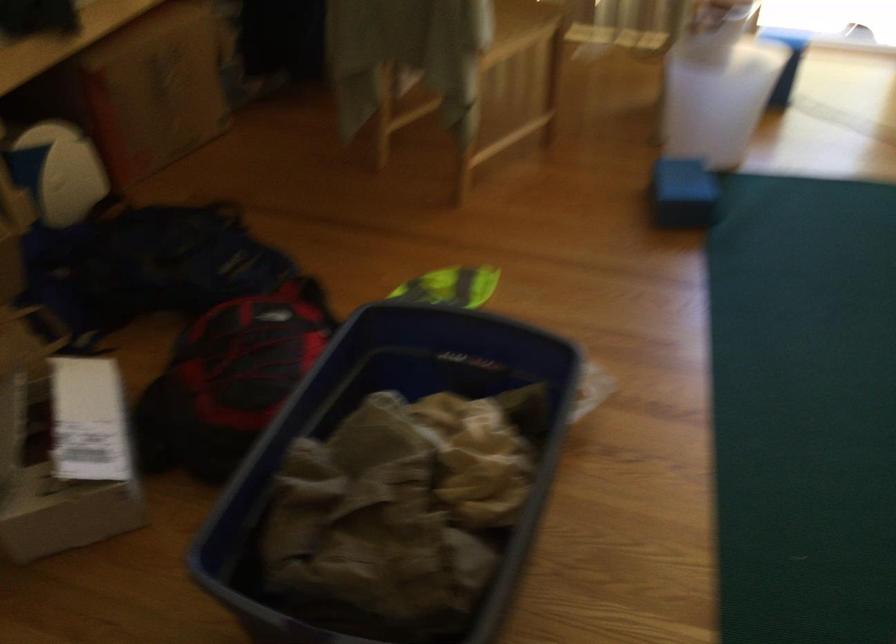
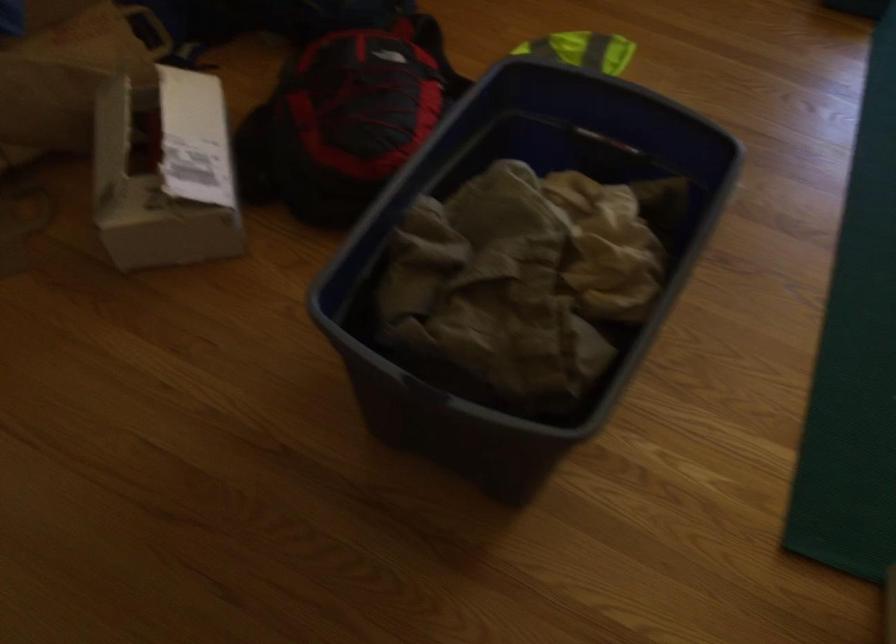
In a continuous first-person perspective shot, in which direction is the camera moving?

The cameraman moved toward left, forward.